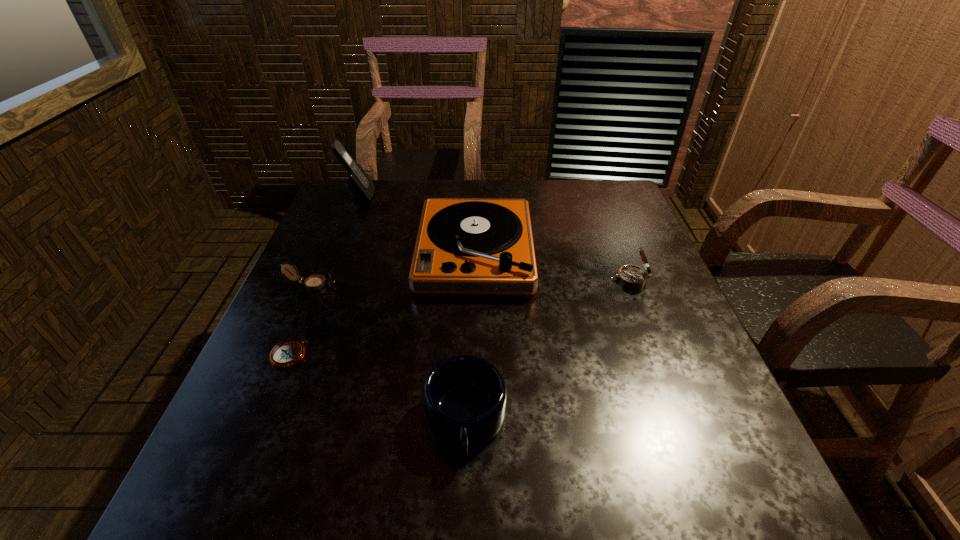
Find the location of `vacant area situated on the right of the record player`. vacant area situated on the right of the record player is located at coordinates (652, 252).

Find the location of a particular element. free space located 0.400m with the dial facing the rightmost compass is located at coordinates (445, 279).

The image size is (960, 540). I want to click on vacant area situated with the dial facing the rightmost compass, so click(x=587, y=279).

The image size is (960, 540). Identify the location of vacant space located 0.210m with the dial facing the rightmost compass. (524, 279).

The image size is (960, 540). I want to click on free region located with the handle on the side of the mug, so click(464, 507).

I want to click on vacant space positioned 0.050m on the face of the fifth tallest object, so click(x=356, y=285).

I want to click on free space located 0.170m on the front of the nearest compass, so click(x=249, y=453).

This screenshot has width=960, height=540. Find the location of `cellular telephone present at the far edge`. cellular telephone present at the far edge is located at coordinates (360, 186).

Where is `record player that is at the far edge`? record player that is at the far edge is located at coordinates (464, 245).

Image resolution: width=960 pixels, height=540 pixels. I want to click on object that is at the near edge, so 465,396.